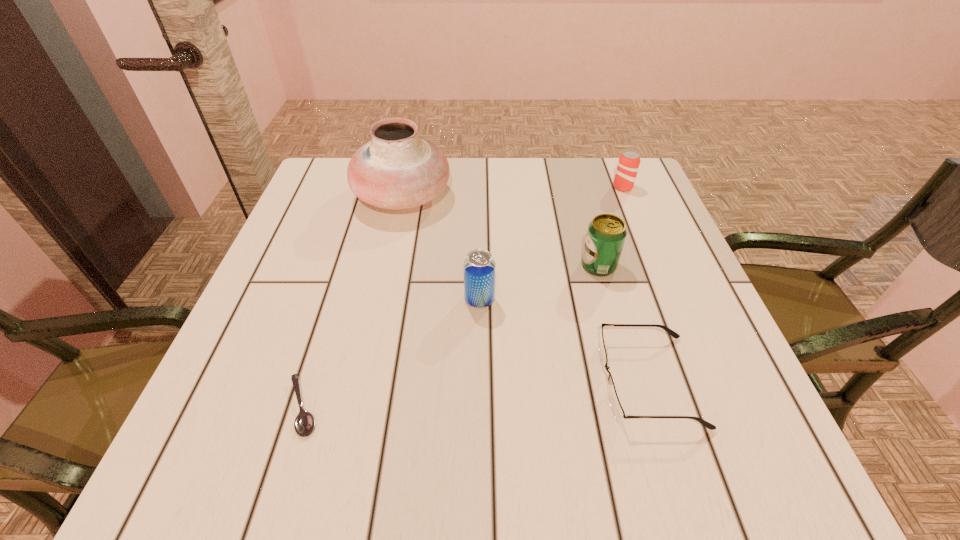
The height and width of the screenshot is (540, 960). In order to click on the tallest object in this screenshot , I will do `click(397, 169)`.

Image resolution: width=960 pixels, height=540 pixels. I want to click on the fourth nearest object, so click(606, 234).

Identify the location of the second beer can from right to left. Image resolution: width=960 pixels, height=540 pixels. (606, 234).

Locate an element on the screen. This screenshot has height=540, width=960. the third object from left to right is located at coordinates pos(479,267).

I want to click on the leftmost beer can, so click(479, 267).

I want to click on the fourth tallest object, so click(x=628, y=164).

The height and width of the screenshot is (540, 960). I want to click on the farthest beer can, so [x=628, y=164].

Where is `the second shortest object`? This screenshot has height=540, width=960. the second shortest object is located at coordinates (619, 414).

I want to click on soupspoon, so click(304, 424).

Locate an element on the screen. Image resolution: width=960 pixels, height=540 pixels. blank space located on the front of the tallest object is located at coordinates (374, 329).